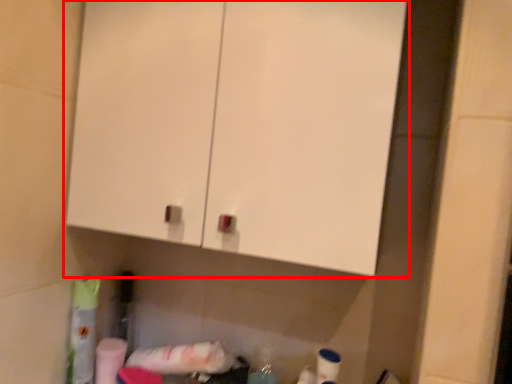
Question: Considering the relative positions of cabinetry (annotated by the red box) and toilet paper in the image provided, where is cabinetry (annotated by the red box) located with respect to the staircase?

Choices:
 (A) left
 (B) right

Answer: (B)